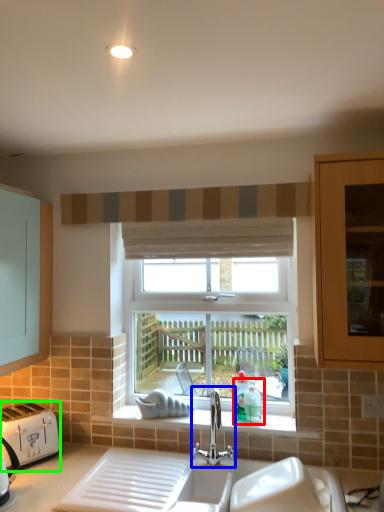
Question: Which object is positioned closest to teal (highlighted by a red box)? Select from tap (highlighted by a blue box) and toaster (highlighted by a green box).

Choices:
 (A) tap
 (B) toaster

Answer: (A)